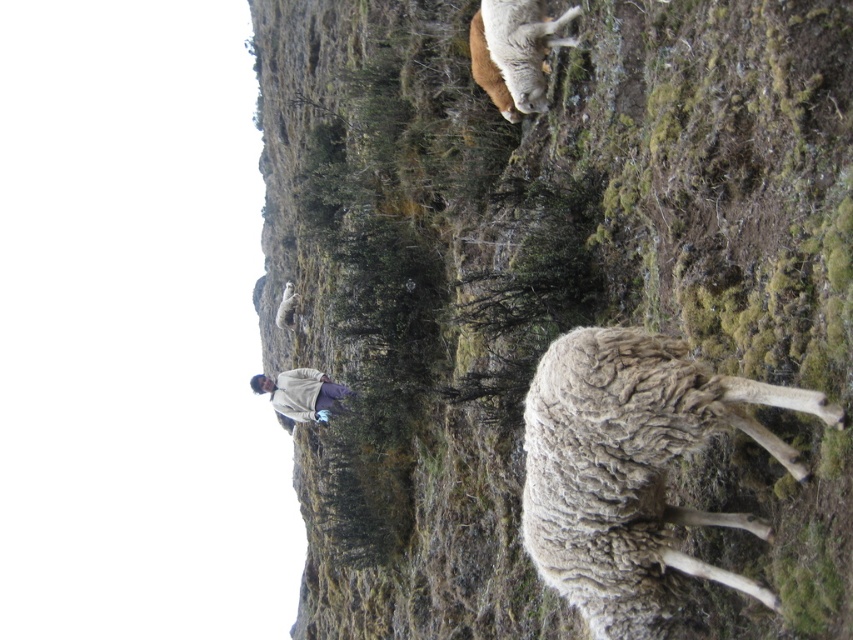
Question: Among these objects, which one is farthest from the camera?

Choices:
 (A) light gray woolen sweater at center
 (B) white woolen sheep at right
 (C) fuzzy wool sheep at center

Answer: (A)

Question: Observing the image, what is the correct spatial positioning of fuzzy wool sheep at center in reference to white woolen sheep at right?

Choices:
 (A) right
 (B) left

Answer: (B)

Question: Which point is farther to the camera?

Choices:
 (A) (608, 445)
 (B) (322, 396)

Answer: (B)

Question: Is white woolen sheep at right to the left of white woolly sheep at upper center from the viewer's perspective?

Choices:
 (A) no
 (B) yes

Answer: (A)

Question: Among these objects, which one is nearest to the camera?

Choices:
 (A) white woolly sheep at upper center
 (B) light gray woolen sweater at center

Answer: (A)

Question: Does white woolen sheep at right have a smaller size compared to white woolly sheep at upper center?

Choices:
 (A) yes
 (B) no

Answer: (B)